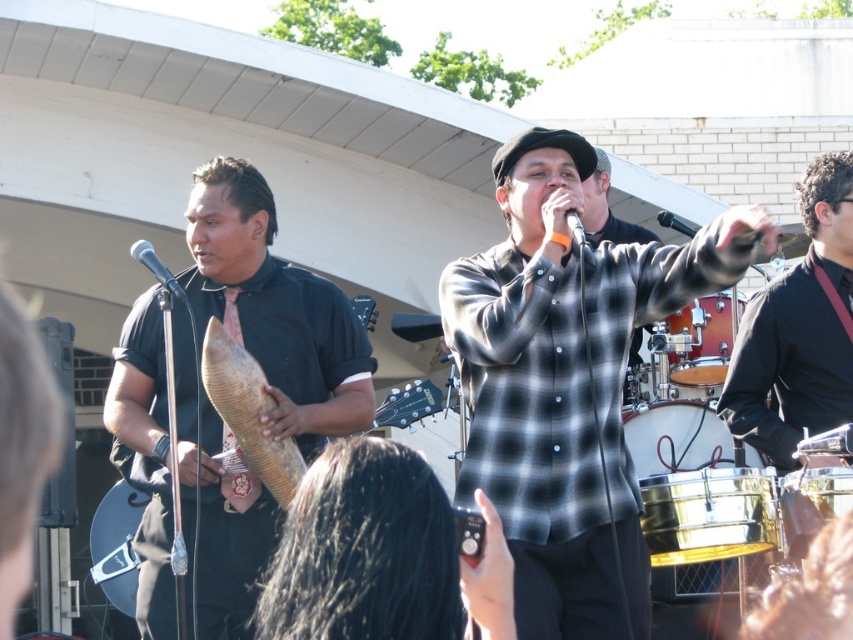
Question: Which of the following is the farthest from the observer?

Choices:
 (A) gold metallic drum at lower right
 (B) metallic silver microphone at center
 (C) wooden drum at center

Answer: (C)

Question: In this image, where is black checkered shirt at center located relative to metallic silver microphone at center?

Choices:
 (A) left
 (B) right

Answer: (B)

Question: Does black smooth shirt at right have a larger size compared to wooden drum at center?

Choices:
 (A) yes
 (B) no

Answer: (B)

Question: Which of the following is the closest to the observer?

Choices:
 (A) (787, 490)
 (B) (689, 234)
 (C) (770, 410)
 (D) (706, 438)

Answer: (A)

Question: Does gold metallic drum at center appear on the right side of metallic silver microphone at center?

Choices:
 (A) yes
 (B) no

Answer: (A)

Question: Among these points, which one is farthest from the camera?

Choices:
 (A) (228, 180)
 (B) (680, 220)
 (C) (751, 320)

Answer: (B)